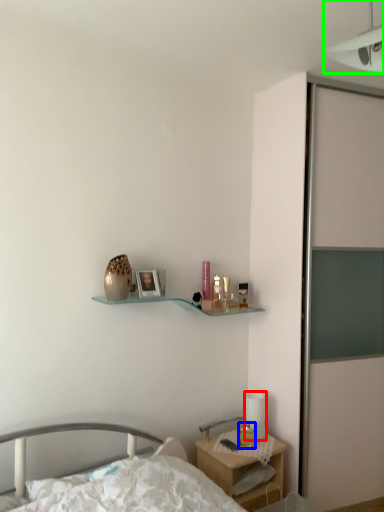
Question: Based on their relative distances, which object is nearer to table lamp (highlighted by a red box)? Choose from candle holder (highlighted by a blue box) and light fixture (highlighted by a green box).

Choices:
 (A) candle holder
 (B) light fixture

Answer: (A)